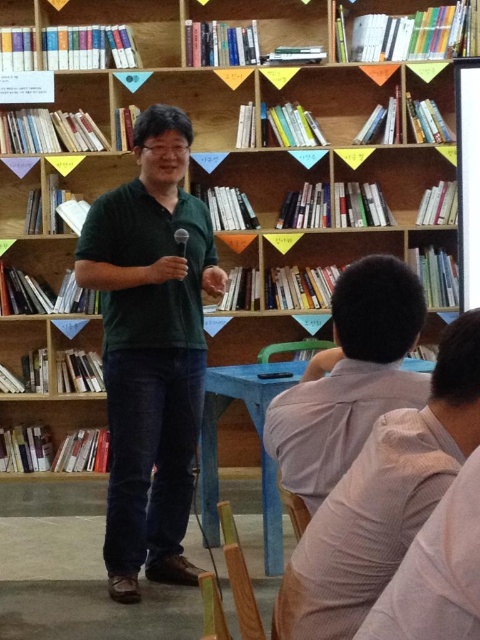
Question: Is gray cotton shirt at lower right further to camera compared to light gray shirt at center?

Choices:
 (A) no
 (B) yes

Answer: (A)

Question: Which of the following is the farthest from the observer?

Choices:
 (A) gray cotton shirt at lower right
 (B) green matte shirt at center

Answer: (B)

Question: Which of the following is the closest to the observer?

Choices:
 (A) green matte shirt at center
 (B) gray cotton shirt at lower right

Answer: (B)

Question: Is green matte shirt at center above light gray shirt at center?

Choices:
 (A) no
 (B) yes

Answer: (A)

Question: Estimate the real-world distances between objects in this image. Which object is farther from the green matte shirt at center?

Choices:
 (A) light gray shirt at center
 (B) gray cotton shirt at lower right

Answer: (B)

Question: Is green matte shirt at center behind light gray shirt at center?

Choices:
 (A) yes
 (B) no

Answer: (A)